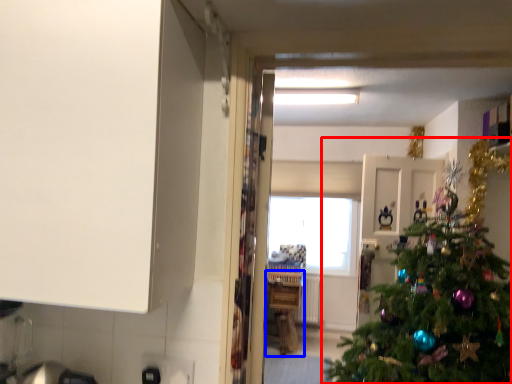
Question: Which object is closer to the camera taking this photo, christmas tree (highlighted by a red box) or counter (highlighted by a blue box)?

Choices:
 (A) christmas tree
 (B) counter

Answer: (A)